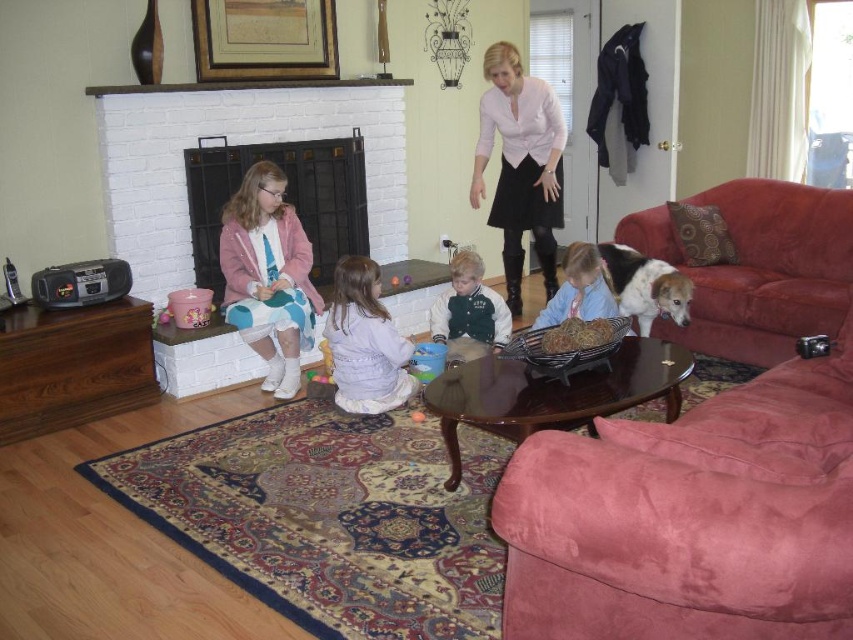
You are standing in the living room and want to place a new decorative item exactly at the center of the room. The light purple fabric dress at center is currently occupying a specific location. Where should you place the new item to ensure it is centered?

The light purple fabric dress at center is located at point (x=364, y=342), which is very close to the true center of the room. To place the new item precisely at the center, you should position it slightly to the left and upwards from the light purple fabric dress at center to reach the exact center coordinates of (x=426, y=320).

You are standing at the entrance of the living room and see the point marked at coordinates (759, 268). What object is located at that point?

The point at coordinates (759, 268) indicates the velvet red couch at right.

From the picture: You are a parent trying to decide where to place a new 1.2 meter tall bookshelf in the living room. The velvet red couch at right and the blue cotton shirt at lower center are already present. Which object should the bookshelf be placed next to so it doesn

The velvet red couch at right is taller than the blue cotton shirt at lower center. Since the bookshelf is 1.2 meters tall, it should be placed next to the velvet red couch at right to maintain visual balance as both are of similar height.